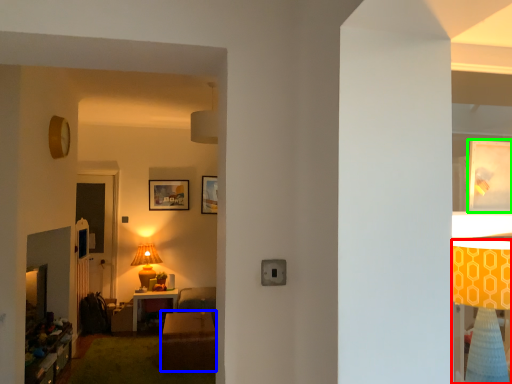
Question: Estimate the real-world distances between objects in this image. Which object is closer to lamp (highlighted by a red box), table (highlighted by a blue box) or picture frame (highlighted by a green box)?

Choices:
 (A) table
 (B) picture frame

Answer: (B)